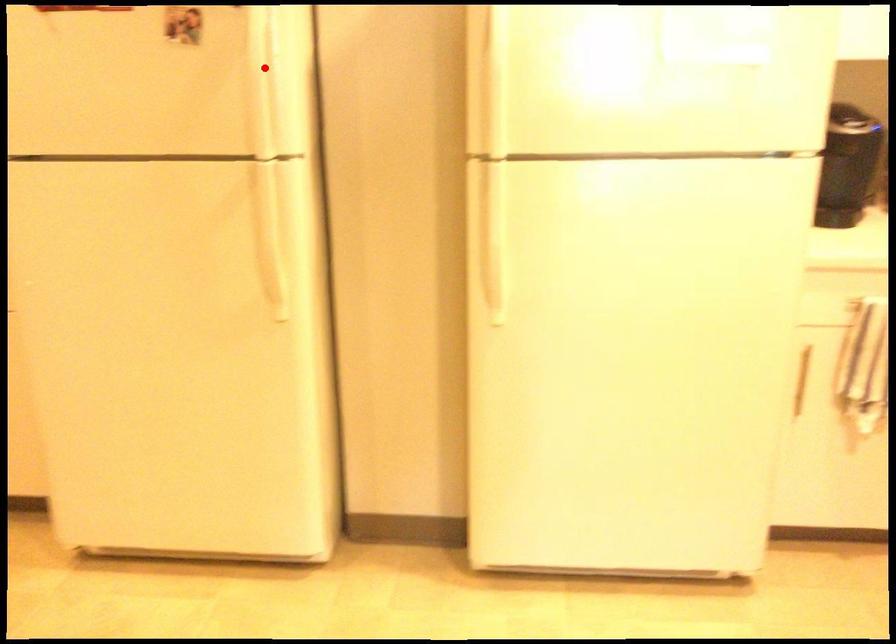
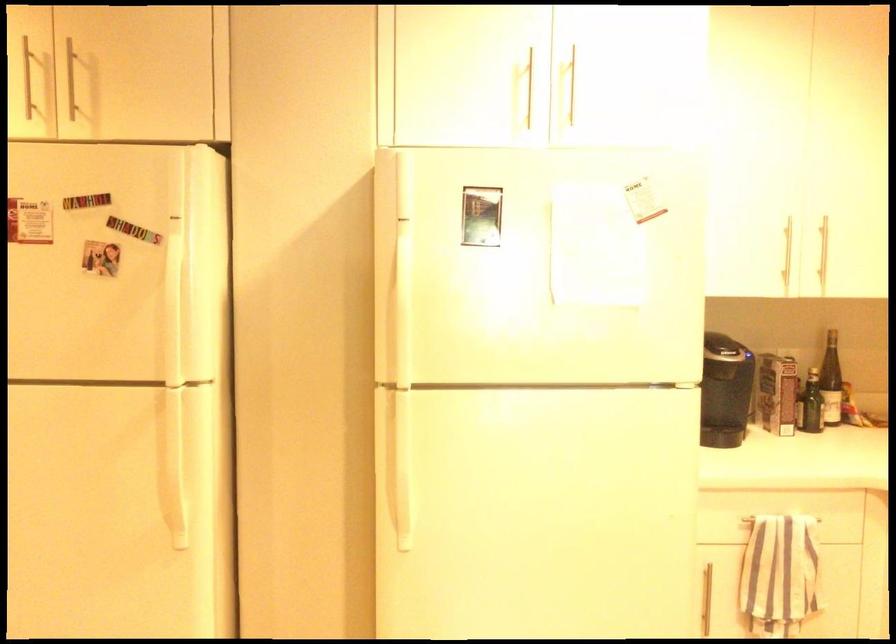
In the second image, find the point that corresponds to the highlighted location in the first image.

(177, 299)